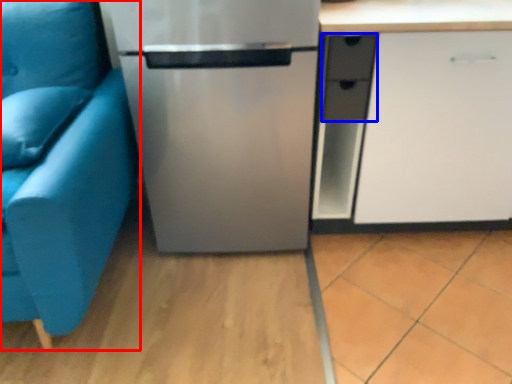
Question: Which point is closer to the camera, studio couch (highlighted by a red box) or drawer (highlighted by a blue box)?

Choices:
 (A) studio couch
 (B) drawer

Answer: (A)